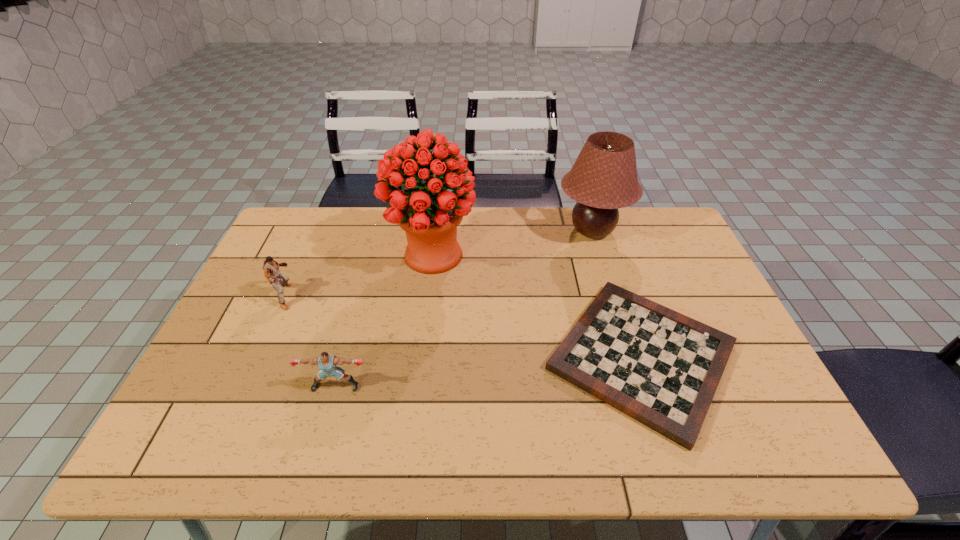
Where is `the tallest object`? the tallest object is located at coordinates (429, 214).

You are a GUI agent. You are given a task and a screenshot of the screen. Output one action in this format:
    pyautogui.click(x=<x>, y=<y>)
    Task: Click on the lampshade
    
    Given the screenshot: What is the action you would take?
    pyautogui.click(x=604, y=178)

Image resolution: width=960 pixels, height=540 pixels. Find the location of `the left puncher`. the left puncher is located at coordinates (271, 269).

Identify the location of the leftmost object. (271, 269).

Where is `the right puncher`? the right puncher is located at coordinates (326, 362).

Identify the location of the shorter puncher. The width and height of the screenshot is (960, 540). (326, 362).

Image resolution: width=960 pixels, height=540 pixels. I want to click on chessboard, so click(662, 368).

Identify the location of blank area located 0.190m on the left of the bouquet. The image size is (960, 540). (329, 255).

Identify the location of free space located 0.190m on the front-facing side of the second tallest object. Image resolution: width=960 pixels, height=540 pixels. (499, 231).

Locate an element on the screen. This screenshot has width=960, height=540. vacant region located 0.230m on the front-facing side of the second tallest object is located at coordinates [x=488, y=231].